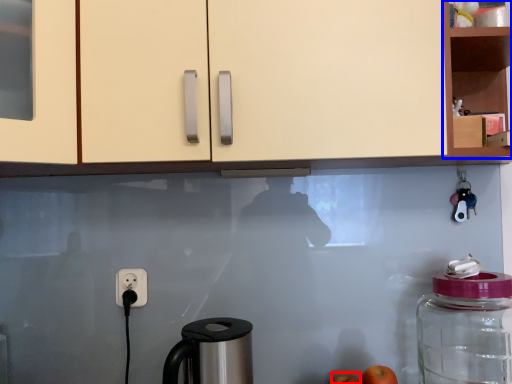
Question: Which point is further to the camera, apple (highlighted by a red box) or cabinetry (highlighted by a blue box)?

Choices:
 (A) apple
 (B) cabinetry

Answer: (A)